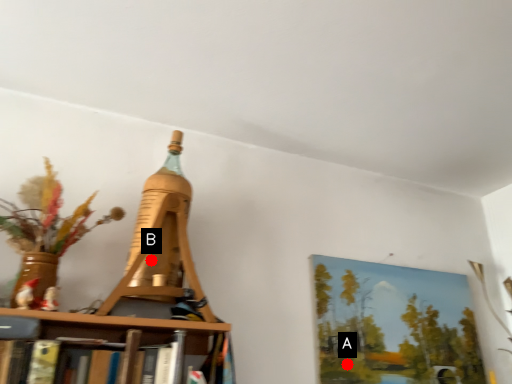
Question: Two points are circled on the image, labeled by A and B beside each circle. Which point is further to the camera?

Choices:
 (A) A is further
 (B) B is further

Answer: (A)